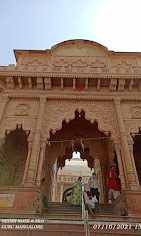
Locate an element on the screen. The width and height of the screenshot is (141, 236). entry is located at coordinates (75, 171).